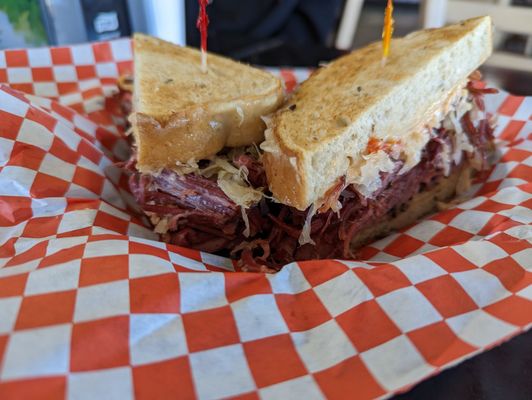
Where is `tabletop`? Image resolution: width=532 pixels, height=400 pixels. tabletop is located at coordinates (507, 376).